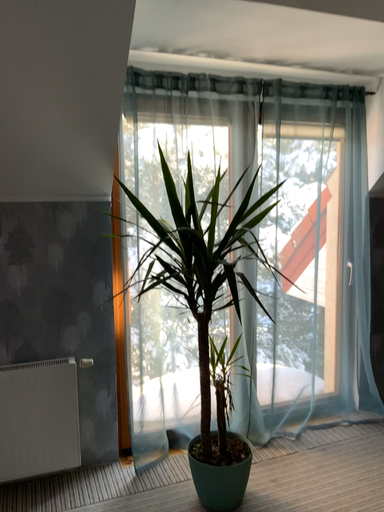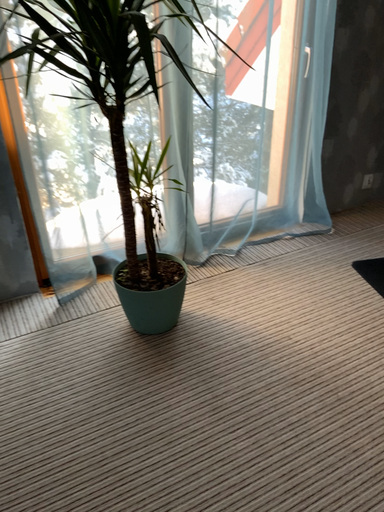
Question: Which way did the camera rotate in the video?

Choices:
 (A) rotated left
 (B) rotated right

Answer: (B)